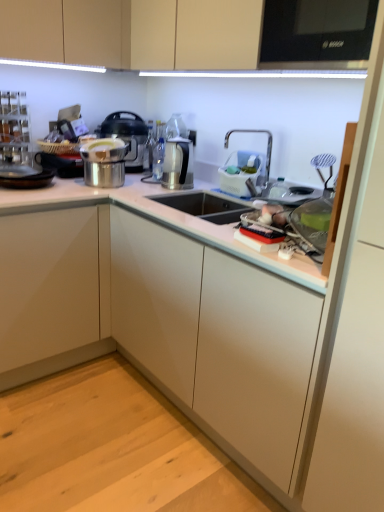
Measure the distance between matte beige cabinets at upper center, which is counted as the 2th cabinetry, starting from the bottom, and camera.

They are 1.37 meters apart.

The height and width of the screenshot is (512, 384). What do you see at coordinates (134, 33) in the screenshot?
I see `matte beige cabinets at upper center, the 1th cabinetry from the top` at bounding box center [134, 33].

Where is `stainless steel pot at center`? This screenshot has width=384, height=512. stainless steel pot at center is located at coordinates 128,137.

In order to face black glossy microwave at upper right, should I rotate leftwards or rightwards?

A 19.199 degree turn to the right will do.

What do you see at coordinates (240, 172) in the screenshot?
I see `white plastic dish rack at upper right, which ranks as the 2th appliance in left-to-right order` at bounding box center [240, 172].

In order to face white plastic dish rack at upper right, acting as the 1th appliance starting from the right, should I rotate leftwards or rightwards?

To align with it, rotate right about 6.058°.

Identify the location of matte beige cabinets at upper center, which ranks as the first cabinetry in right-to-left order. The height and width of the screenshot is (512, 384). (134, 33).

Could you tell me if stainless steel pot at center is turned towards white glossy cabinet at lower left, the first cabinetry from the left?

No.

Does stainless steel pot at center have a greater width compared to white glossy cabinet at lower left, the first cabinetry from the left?

In fact, stainless steel pot at center might be narrower than white glossy cabinet at lower left, the first cabinetry from the left.

From a real-world perspective, is stainless steel pot at center on white glossy cabinet at lower left, which is counted as the 2th cabinetry, starting from the right?

Yes, from a real-world perspective, stainless steel pot at center is on top of white glossy cabinet at lower left, which is counted as the 2th cabinetry, starting from the right.

In the scene shown: From the image's perspective, does white plastic dish rack at upper right, which ranks as the 2th appliance in left-to-right order, appear higher than matte beige cabinets at upper center, which ranks as the first cabinetry in right-to-left order?

No, from the image's perspective, white plastic dish rack at upper right, which ranks as the 2th appliance in left-to-right order, is not above matte beige cabinets at upper center, which ranks as the first cabinetry in right-to-left order.

There is a white plastic dish rack at upper right, acting as the 1th appliance starting from the right. At what (x,y) coordinates should I click in order to perform the action: click on cabinetry above it (from a real-world perspective). Please return your answer as a coordinate pair (x, y). This screenshot has height=512, width=384. Looking at the image, I should click on (134, 33).

Is white plastic dish rack at upper right, which ranks as the 2th appliance in left-to-right order, far away from matte beige cabinets at upper center, which ranks as the first cabinetry in right-to-left order?

white plastic dish rack at upper right, which ranks as the 2th appliance in left-to-right order, is actually quite close to matte beige cabinets at upper center, which ranks as the first cabinetry in right-to-left order.

Looking at this image, is white plastic dish rack at upper right, acting as the 1th appliance starting from the right, outside of matte beige cabinets at upper center, which ranks as the first cabinetry in right-to-left order?

Yes.

Which is closer, (284, 181) or (166, 186)?

Point (284, 181) is positioned closer to the camera compared to point (166, 186).

Between white plastic sink at upper right and satin silver kettle at center, the first appliance positioned from the left, which one has smaller size?

satin silver kettle at center, the first appliance positioned from the left, is smaller.

In terms of height, does white plastic sink at upper right look taller or shorter compared to satin silver kettle at center, the first appliance positioned from the left?

Considering their sizes, white plastic sink at upper right has more height than satin silver kettle at center, the first appliance positioned from the left.

Is matte beige cabinets at upper center, the 1th cabinetry from the top, turned away from black glossy microwave at upper right?

Yes, matte beige cabinets at upper center, the 1th cabinetry from the top, is positioned with its back facing black glossy microwave at upper right.

Would you say black glossy microwave at upper right is part of matte beige cabinets at upper center, which is counted as the 2th cabinetry, starting from the bottom,'s contents?

Yes, black glossy microwave at upper right is inside matte beige cabinets at upper center, which is counted as the 2th cabinetry, starting from the bottom.

Which of these two, matte beige cabinets at upper center, which ranks as the first cabinetry in right-to-left order, or black glossy microwave at upper right, is smaller?

With smaller size is black glossy microwave at upper right.

I want to click on home appliance on the right of matte beige cabinets at upper center, the 1th cabinetry from the top, so click(x=317, y=34).

Locate an element on the screen. home appliance on the right side of satin silver kettle at center, the first appliance positioned from the left is located at coordinates pyautogui.click(x=317, y=34).

From the picture: Can you confirm if black glossy microwave at upper right is taller than satin silver kettle at center, the 2th appliance positioned from the right?

Yes, black glossy microwave at upper right is taller than satin silver kettle at center, the 2th appliance positioned from the right.

Is black glossy microwave at upper right positioned with its back to satin silver kettle at center, the 2th appliance positioned from the right?

black glossy microwave at upper right is not turned away from satin silver kettle at center, the 2th appliance positioned from the right.

Is stainless steel pot at center looking in the opposite direction of black glossy microwave at upper right?

That's not correct — stainless steel pot at center is not looking away from black glossy microwave at upper right.

Is point (132, 116) more distant than point (347, 30)?

Yes, it is.

From the image's perspective, who appears lower, stainless steel pot at center or black glossy microwave at upper right?

stainless steel pot at center.

Consider the image. Between white plastic sink at upper right and white plastic dish rack at upper right, which ranks as the 2th appliance in left-to-right order, which one has less height?

white plastic dish rack at upper right, which ranks as the 2th appliance in left-to-right order, is shorter.

You are a GUI agent. You are given a task and a screenshot of the screen. Output one action in this format:
    pyautogui.click(x=<x>, y=<y>)
    Task: Click on the sink above the white plastic dish rack at upper right, which ranks as the 2th appliance in left-to-right order (from a real-world perspective)
    The image size is (384, 512).
    Given the screenshot: What is the action you would take?
    pyautogui.click(x=275, y=180)

How much distance is there between white plastic sink at upper right and white plastic dish rack at upper right, which ranks as the 2th appliance in left-to-right order?

white plastic sink at upper right and white plastic dish rack at upper right, which ranks as the 2th appliance in left-to-right order, are 4.76 inches apart.

Find the location of a particular element. cabinetry below the stainless steel pot at center (from the image's perspective) is located at coordinates coord(53,291).

Image resolution: width=384 pixels, height=512 pixels. I want to click on appliance to the right of matte beige cabinets at upper center, which ranks as the first cabinetry in right-to-left order, so click(x=240, y=172).

Estimate the real-world distances between objects in this image. Which object is further from white glossy cabinet at lower left, positioned as the first cabinetry in bottom-to-top order, white plastic dish rack at upper right, which ranks as the 2th appliance in left-to-right order, or matte beige cabinets at upper center, the 1th cabinetry from the top?

matte beige cabinets at upper center, the 1th cabinetry from the top, is further to white glossy cabinet at lower left, positioned as the first cabinetry in bottom-to-top order.

Considering their positions, is white plastic dish rack at upper right, acting as the 1th appliance starting from the right, positioned further to stainless steel pot at center than matte beige cabinets at upper center, which ranks as the first cabinetry in right-to-left order?

The object further to stainless steel pot at center is white plastic dish rack at upper right, acting as the 1th appliance starting from the right.

Looking at the image, which one is located closer to white plastic dish rack at upper right, which ranks as the 2th appliance in left-to-right order, black glossy microwave at upper right or matte beige cabinets at upper center, which is counted as the 2th cabinetry, starting from the bottom?

Based on the image, matte beige cabinets at upper center, which is counted as the 2th cabinetry, starting from the bottom, appears to be nearer to white plastic dish rack at upper right, which ranks as the 2th appliance in left-to-right order.

Based on their spatial positions, is white plastic dish rack at upper right, acting as the 1th appliance starting from the right, or white plastic sink at upper right closer to stainless steel pot at center?

white plastic dish rack at upper right, acting as the 1th appliance starting from the right.

Considering their positions, is white plastic sink at upper right positioned closer to white glossy cabinet at lower left, which is counted as the 2th cabinetry, starting from the right, than black glossy microwave at upper right?

Based on the image, white plastic sink at upper right appears to be nearer to white glossy cabinet at lower left, which is counted as the 2th cabinetry, starting from the right.

Which object lies nearer to the anchor point stainless steel pot at center, satin silver kettle at center, the first appliance positioned from the left, or white glossy cabinet at lower left, which is counted as the 2th cabinetry, starting from the right?

satin silver kettle at center, the first appliance positioned from the left, is positioned closer to the anchor stainless steel pot at center.

Looking at the image, which one is located further to white plastic dish rack at upper right, acting as the 1th appliance starting from the right, stainless steel pot at center or white plastic sink at upper right?

Among the two, stainless steel pot at center is located further to white plastic dish rack at upper right, acting as the 1th appliance starting from the right.

Which object lies nearer to the anchor point white glossy cabinet at lower left, which is counted as the 2th cabinetry, starting from the right, stainless steel pot at center or matte beige cabinets at upper center, the 1th cabinetry from the top?

Among the two, stainless steel pot at center is located nearer to white glossy cabinet at lower left, which is counted as the 2th cabinetry, starting from the right.

Where is `sink situated between white glossy cabinet at lower left, positioned as the first cabinetry in bottom-to-top order, and black glossy microwave at upper right from left to right`? sink situated between white glossy cabinet at lower left, positioned as the first cabinetry in bottom-to-top order, and black glossy microwave at upper right from left to right is located at coordinates (275, 180).

The image size is (384, 512). I want to click on appliance between stainless steel pot at center and white plastic dish rack at upper right, acting as the 1th appliance starting from the right, in the horizontal direction, so click(x=178, y=164).

Where is `kitchen appliance between white glossy cabinet at lower left, positioned as the first cabinetry in bottom-to-top order, and white plastic dish rack at upper right, which ranks as the 2th appliance in left-to-right order, from left to right`? The image size is (384, 512). kitchen appliance between white glossy cabinet at lower left, positioned as the first cabinetry in bottom-to-top order, and white plastic dish rack at upper right, which ranks as the 2th appliance in left-to-right order, from left to right is located at coordinates (128, 137).

At what (x,y) coordinates should I click in order to perform the action: click on cabinetry between white glossy cabinet at lower left, which is counted as the 2th cabinetry, starting from the right, and black glossy microwave at upper right from left to right. Please return your answer as a coordinate pair (x, y). The width and height of the screenshot is (384, 512). Looking at the image, I should click on (134, 33).